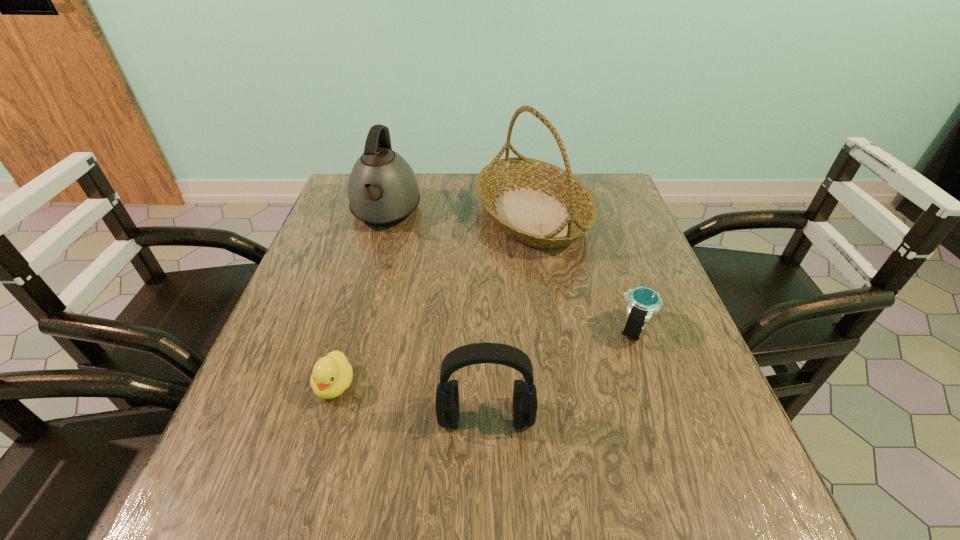
In order to click on vacant point located between the basket and the shortest object in this screenshot , I will do coord(434,300).

The width and height of the screenshot is (960, 540). What are the coordinates of `vacant point located between the basket and the second tallest object` in the screenshot? It's located at (459, 214).

The width and height of the screenshot is (960, 540). In order to click on vacant point located between the headset and the duckling in this screenshot , I will do `click(411, 401)`.

This screenshot has width=960, height=540. I want to click on unoccupied position between the third shortest object and the kettle, so click(436, 315).

Locate an element on the screen. Image resolution: width=960 pixels, height=540 pixels. object that is the fourth closest to the kettle is located at coordinates (642, 302).

Select which object appears as the third closest to the shortest object. Please provide its 2D coordinates. Your answer should be formatted as a tuple, i.e. [(x, y)], where the tuple contains the x and y coordinates of a point satisfying the conditions above.

[(382, 189)]

In order to click on free space that satisfies the following two spatial constraints: 1. at the spout of the fourth shortest object; 2. on the right side of the third farthest object in this screenshot , I will do `click(353, 329)`.

Locate an element on the screen. This screenshot has height=540, width=960. free space in the image that satisfies the following two spatial constraints: 1. at the spout of the kettle; 2. on the left side of the tallest object is located at coordinates (385, 214).